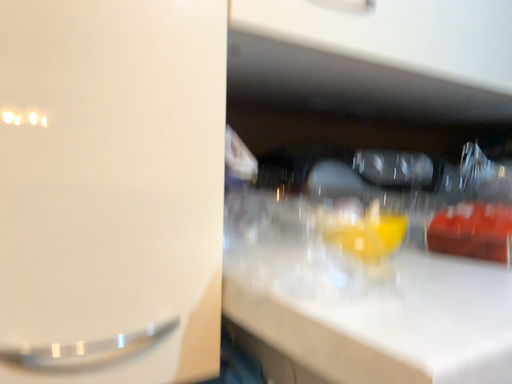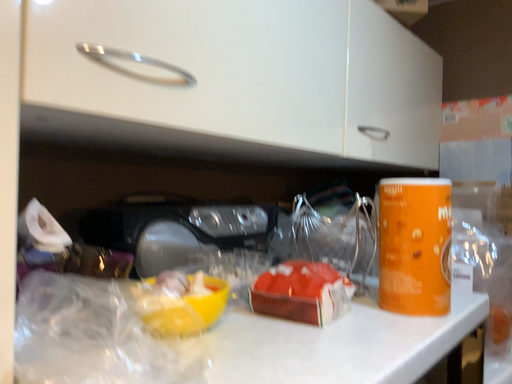
Question: How did the camera likely rotate when shooting the video?

Choices:
 (A) rotated right
 (B) rotated left

Answer: (A)